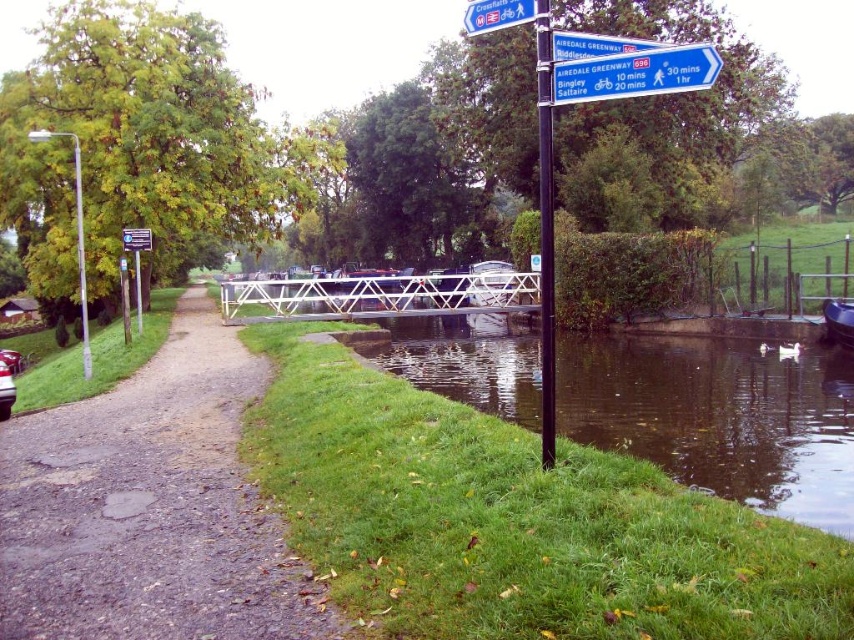
Which is below, blue plastic signpost at upper right or metallic rectangular sign at center?

blue plastic signpost at upper right is below.

Does blue plastic signpost at upper right come behind metallic rectangular sign at center?

No, blue plastic signpost at upper right is closer to the viewer.

Is point (607, 58) farther from viewer compared to point (139, 243)?

That is False.

You are a GUI agent. You are given a task and a screenshot of the screen. Output one action in this format:
    pyautogui.click(x=<x>, y=<y>)
    Task: Click on the blue plastic signpost at upper right
    The width and height of the screenshot is (854, 640).
    Given the screenshot: What is the action you would take?
    pyautogui.click(x=635, y=74)

Can you confirm if dirt/gravel path at left is thinner than green smooth water at lower right?

Yes, dirt/gravel path at left is thinner than green smooth water at lower right.

Is dirt/gravel path at left below green smooth water at lower right?

Yes.

Does point (145, 528) come closer to viewer compared to point (539, 346)?

Yes, it is in front of point (539, 346).

This screenshot has height=640, width=854. What are the coordinates of `dirt/gravel path at left` in the screenshot? It's located at 150,508.

Is point (541, 152) in front of point (589, 56)?

No.

Is point (550, 337) farther from camera compared to point (553, 36)?

Yes, it is.

Identify the location of black metal signpost at center. (545, 228).